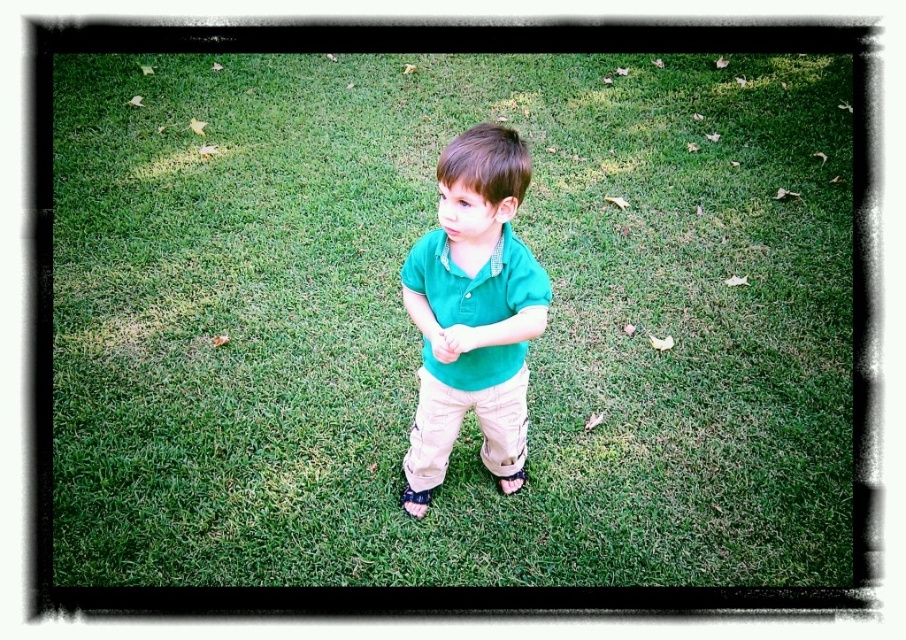
You are a fashion designer observing the child in the image. You need to determine which item of clothing or footwear is bigger in size between the khaki cotton pants at center and the black leather sandal at lower center. Which one is bigger?

The khaki cotton pants at center is larger in size than the black leather sandal at lower center.

You are a fashion designer observing the child in the scene. You need to determine which item of clothing is bigger between the green cotton shirt at center and the black leather sandal at lower center. Which one is larger?

The green cotton shirt at center has a larger size compared to the black leather sandal at lower center, so the green cotton shirt at center is larger.

You are a photographer setting up for a shoot. You need to position a camera so that the green cotton shirt at center and the black leather sandal at lower center are both in focus. Given that the camera can focus on objects within a 20 inch range, will both objects be in focus?

The green cotton shirt at center is 24.43 inches away from the black leather sandal at lower center. Since the distance between them exceeds the camera focus range of 20 inches, the camera may not be able to keep both in focus simultaneously.